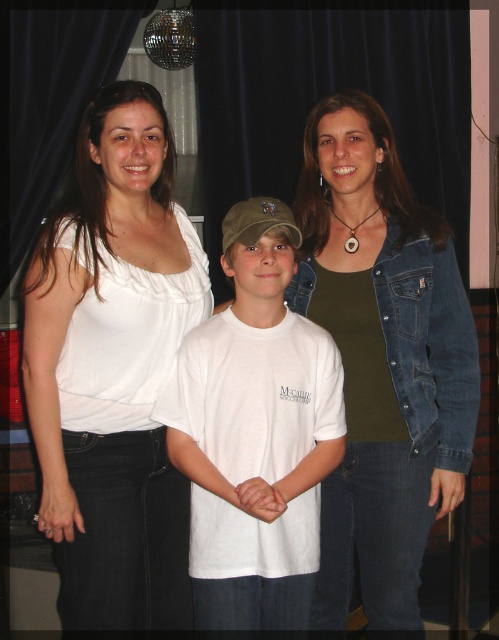
From the picture: You are a photographer trying to adjust the lighting for a group photo. You notice two items in the scene that might cast shadows on the subjects. Which item is closer to the camera between the white cotton blouse at upper left and the denim jacket at right?

The white cotton blouse at upper left is closer to the camera because it is in front of the denim jacket at right.